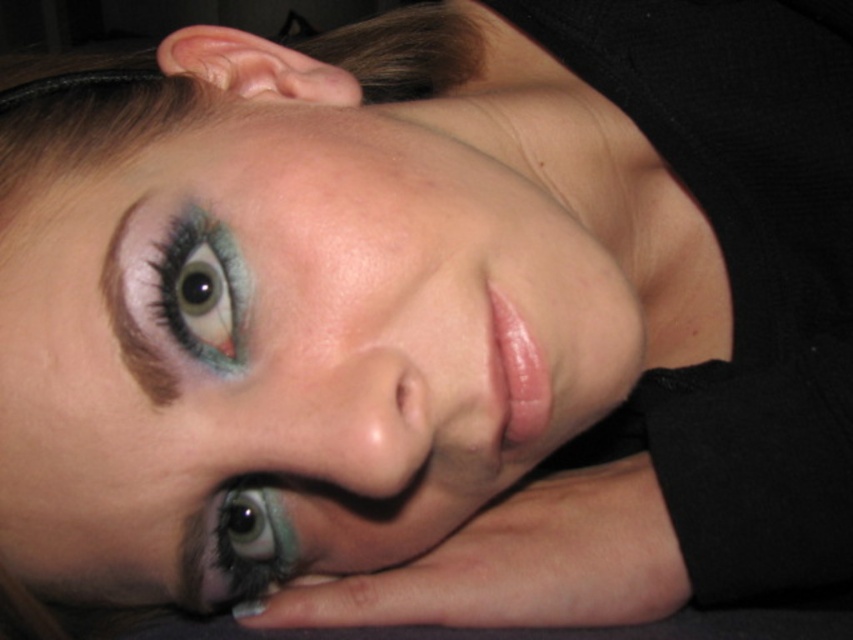
Is smooth skin face at center below shiny blue eye at lower left?

Actually, smooth skin face at center is above shiny blue eye at lower left.

This screenshot has width=853, height=640. What do you see at coordinates (294, 342) in the screenshot? I see `smooth skin face at center` at bounding box center [294, 342].

The image size is (853, 640). What are the coordinates of `smooth skin face at center` in the screenshot? It's located at (294, 342).

Find the location of `matte green eye at upper left`. matte green eye at upper left is located at coordinates (x=202, y=289).

Can you confirm if matte green eye at upper left is bigger than brown matte eyebrow at upper left?

Actually, matte green eye at upper left might be smaller than brown matte eyebrow at upper left.

The width and height of the screenshot is (853, 640). What do you see at coordinates (202, 289) in the screenshot? I see `matte green eye at upper left` at bounding box center [202, 289].

Locate an element on the screen. matte green eye at upper left is located at coordinates tap(202, 289).

Does point (194, 184) come farther from viewer compared to point (149, 358)?

Yes, it is behind point (149, 358).

Is smooth skin face at center thinner than brown matte eyebrow at upper left?

In fact, smooth skin face at center might be wider than brown matte eyebrow at upper left.

I want to click on smooth skin face at center, so click(x=294, y=342).

Where is `smooth skin face at center`? This screenshot has width=853, height=640. smooth skin face at center is located at coordinates (294, 342).